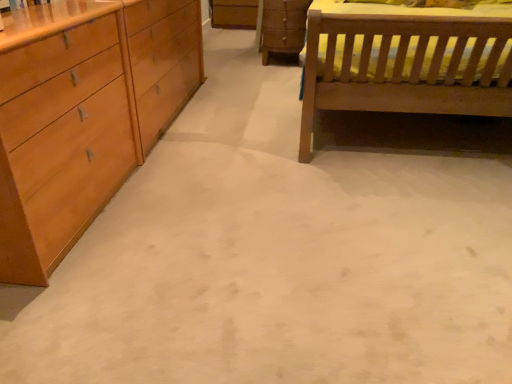
In order to click on wooden chest of drawers at center in this screenshot , I will do `click(282, 27)`.

Describe the element at coordinates (282, 27) in the screenshot. I see `wooden chest of drawers at center` at that location.

Find the location of a particular element. The height and width of the screenshot is (384, 512). wooden chest of drawers at center is located at coordinates (282, 27).